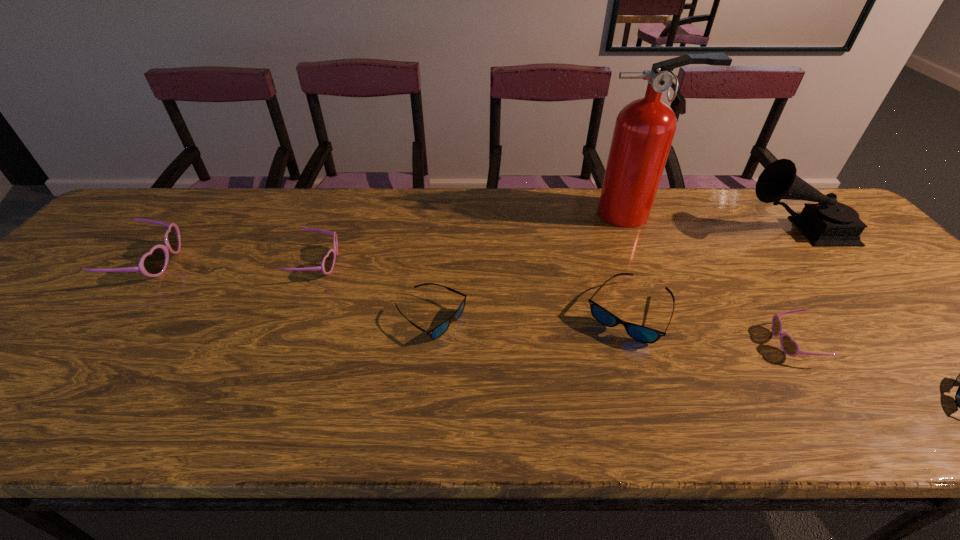
At what (x,y) coordinates should I click in order to perform the action: click on empty location between the sixth object from left to right and the biggest blue sunglasses. Please return your answer as a coordinate pair (x, y). Looking at the image, I should click on (710, 328).

Select which object is the fourth closest to the rightmost pink sunglasses. Please provide its 2D coordinates. Your answer should be formatted as a tuple, i.e. [(x, y)], where the tuple contains the x and y coordinates of a point satisfying the conditions above.

[(644, 130)]

Find the location of `object that is the sixth closest to the rightmost pink sunglasses`. object that is the sixth closest to the rightmost pink sunglasses is located at coordinates (328, 262).

Identify the location of the fifth closest sunglasses to the fire extinguisher. (328, 262).

At what (x,y) coordinates should I click in order to perform the action: click on sunglasses that can be found as the second closest to the second blue sunglasses from right to left. Please return your answer as a coordinate pair (x, y). Looking at the image, I should click on (438, 331).

Locate an element on the screen. pink sunglasses that is the closest one to the tallest object is located at coordinates (790, 347).

Select which pink sunglasses is the closest to the phonograph_record. Please provide its 2D coordinates. Your answer should be formatted as a tuple, i.e. [(x, y)], where the tuple contains the x and y coordinates of a point satisfying the conditions above.

[(790, 347)]

Select which blue sunglasses appears as the third closest to the rightmost pink sunglasses. Please provide its 2D coordinates. Your answer should be formatted as a tuple, i.e. [(x, y)], where the tuple contains the x and y coordinates of a point satisfying the conditions above.

[(438, 331)]

Identify the location of blue sunglasses that is the closest one to the third sunglasses from left to right. The height and width of the screenshot is (540, 960). (640, 333).

Identify the location of vacant space that satisfies the following two spatial constraints: 1. on the front side of the fire extinguisher; 2. on the front-facing side of the second smallest pink sunglasses. The width and height of the screenshot is (960, 540). (655, 263).